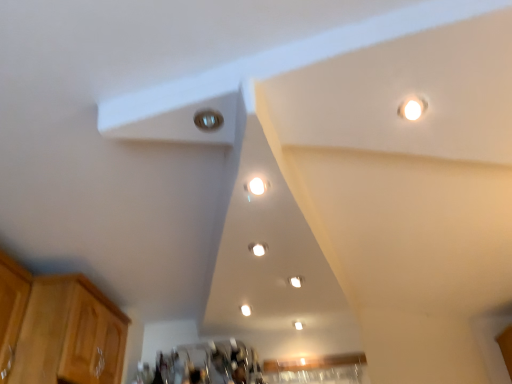
Question: Are matte white light fixture at center, the second dot viewed from the left, and metallic silver light at upper center located far from each other?

Choices:
 (A) no
 (B) yes

Answer: (A)

Question: Considering the relative sizes of matte white light fixture at center, the second dot positioned from the top, and metallic silver light at upper center in the image provided, is matte white light fixture at center, the second dot positioned from the top, taller than metallic silver light at upper center?

Choices:
 (A) yes
 (B) no

Answer: (A)

Question: Can you confirm if matte white light fixture at center, the second dot positioned from the top, is bigger than metallic silver light at upper center?

Choices:
 (A) no
 (B) yes

Answer: (B)

Question: Considering the relative sizes of matte white light fixture at center, the second dot viewed from the left, and metallic silver light at upper center in the image provided, is matte white light fixture at center, the second dot viewed from the left, thinner than metallic silver light at upper center?

Choices:
 (A) no
 (B) yes

Answer: (B)

Question: Is matte white light fixture at center, the second dot viewed from the left, outside of metallic silver light at upper center?

Choices:
 (A) no
 (B) yes

Answer: (B)

Question: Considering the positions of point (262, 244) and point (254, 193), is point (262, 244) closer or farther from the camera than point (254, 193)?

Choices:
 (A) farther
 (B) closer

Answer: (A)

Question: In terms of size, does matte white light fixture at center, arranged as the second dot when ordered from the bottom, appear bigger or smaller than white glossy light fixture at center, marked as the 1th dot in a left-to-right arrangement?

Choices:
 (A) big
 (B) small

Answer: (A)

Question: Would you say matte white light fixture at center, the second dot viewed from the left, is inside or outside white glossy light fixture at center, the 3th dot when ordered from right to left?

Choices:
 (A) inside
 (B) outside

Answer: (B)

Question: From the image's perspective, relative to white glossy light fixture at center, which is the 1th dot from front to back, is matte white light fixture at center, the second dot when ordered from back to front, above or below?

Choices:
 (A) above
 (B) below

Answer: (B)

Question: From a real-world perspective, is white glossy light fixture at center, acting as the first dot starting from the top, above or below white glossy light fixture at center, which is counted as the first dot, starting from the back?

Choices:
 (A) above
 (B) below

Answer: (B)

Question: From the image's perspective, is white glossy light fixture at center, acting as the 3th dot starting from the back, located above or below white glossy light fixture at center, arranged as the 1th dot when ordered from the bottom?

Choices:
 (A) above
 (B) below

Answer: (A)

Question: Is white glossy light fixture at center, the 3th dot when ordered from right to left, inside the boundaries of white glossy light fixture at center, positioned as the third dot in left-to-right order, or outside?

Choices:
 (A) outside
 (B) inside

Answer: (A)

Question: Considering their positions, is white glossy light fixture at center, acting as the first dot starting from the top, located in front of or behind white glossy light fixture at center, which ranks as the first dot in right-to-left order?

Choices:
 (A) front
 (B) behind

Answer: (A)

Question: From a real-world perspective, is white glossy light fixture at center, which ranks as the first dot in right-to-left order, positioned above or below white glossy light fixture at center, acting as the first dot starting from the top?

Choices:
 (A) above
 (B) below

Answer: (A)

Question: Choose the correct answer: Is white glossy light fixture at center, the 3th dot positioned from the front, inside white glossy light fixture at center, which ranks as the third dot in bottom-to-top order, or outside it?

Choices:
 (A) inside
 (B) outside

Answer: (B)